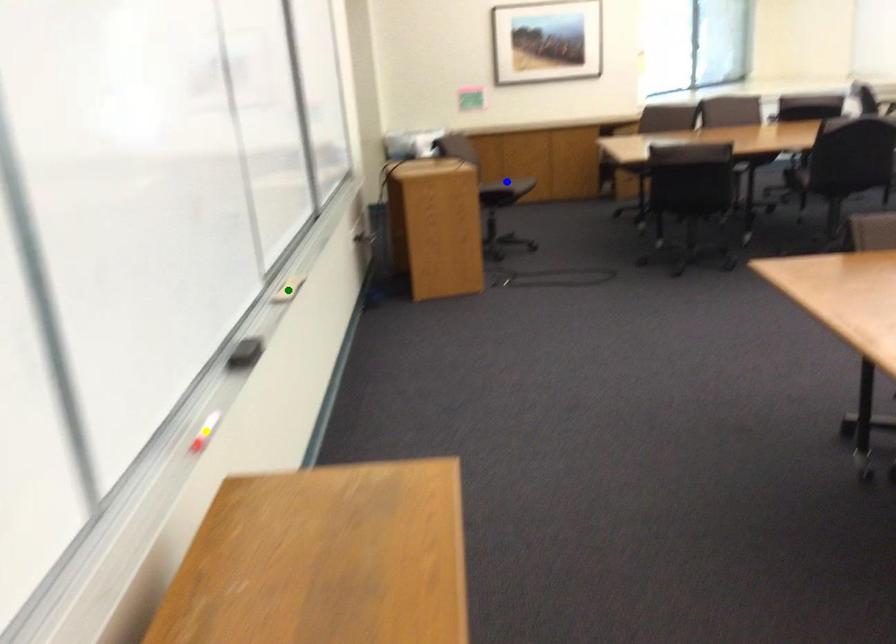
Order these from nearest to farthest:
blue point
green point
yellow point

yellow point → green point → blue point